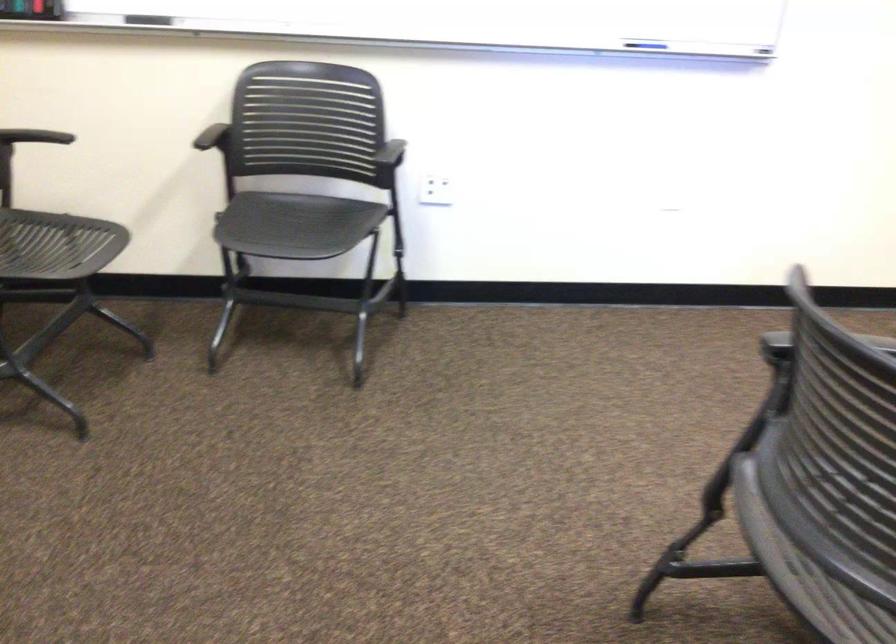
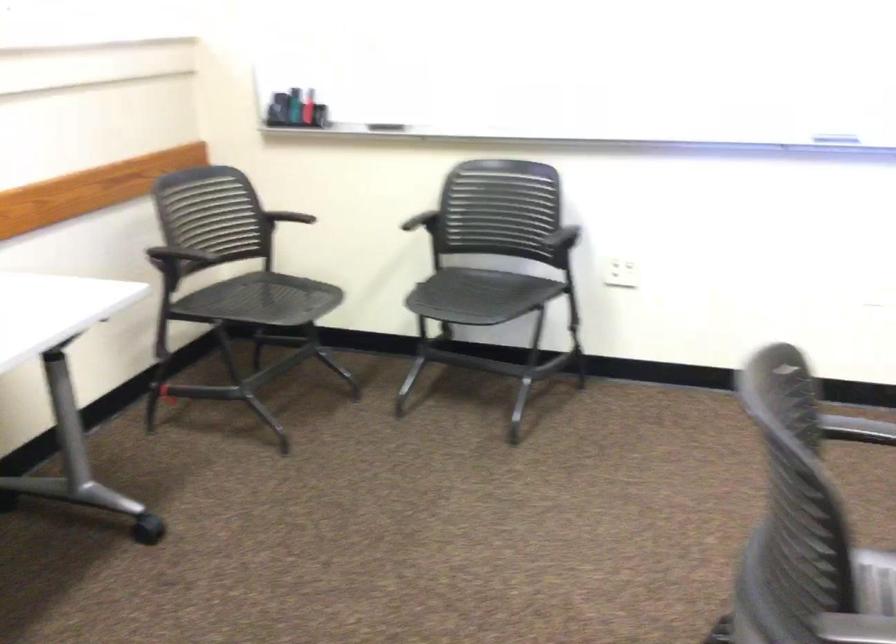
Question: In a continuous first-person perspective shot, in which direction is the camera moving?

Choices:
 (A) Left
 (B) Right
 (C) Forward
 (D) Backward

Answer: (B)